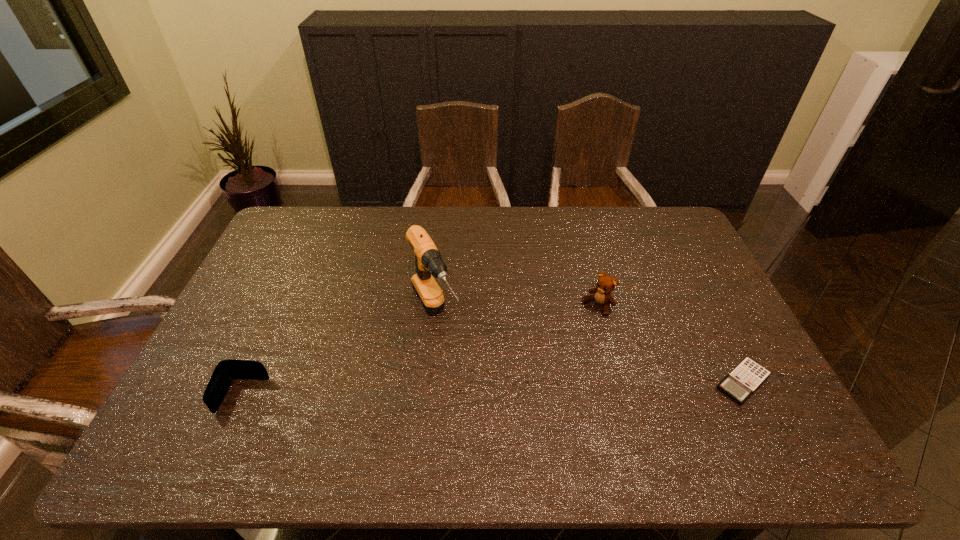
Find the location of `vacant space on the desktop that is between the wallet and the rightmost object and is positioned at the tip of the tallest object`. vacant space on the desktop that is between the wallet and the rightmost object and is positioned at the tip of the tallest object is located at coordinates (479, 389).

Locate an element on the screen. free space on the desktop that is between the leftmost object and the shortest object and is positioned on the front-facing side of the third shortest object is located at coordinates (509, 389).